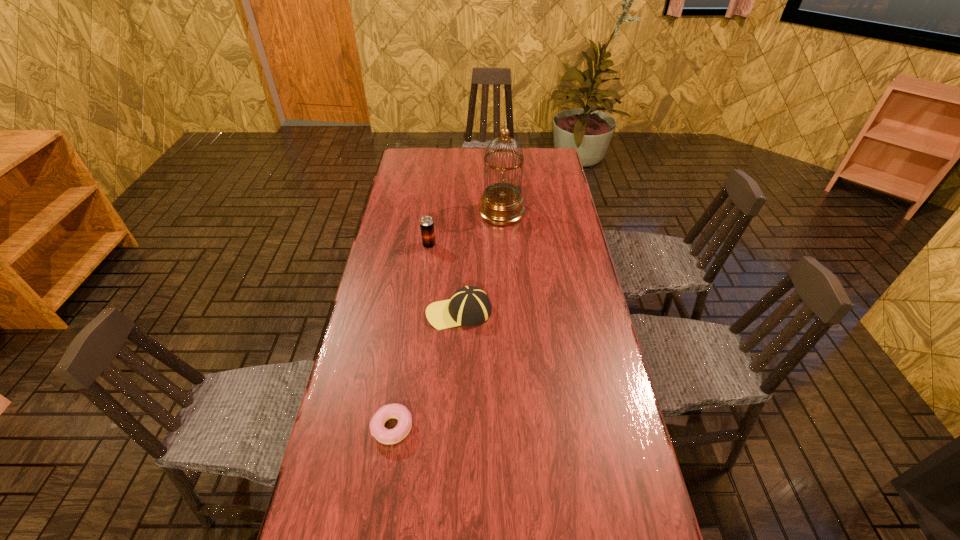
You are a GUI agent. You are given a task and a screenshot of the screen. Output one action in this format:
    pyautogui.click(x=<x>, y=<y>)
    Task: Click on the birdcage
    
    Given the screenshot: What is the action you would take?
    pyautogui.click(x=501, y=204)

This screenshot has height=540, width=960. What are the coordinates of `the farthest object` in the screenshot? It's located at (501, 204).

Find the location of `the third nearest object`. the third nearest object is located at coordinates (426, 223).

Where is `beer can`? Image resolution: width=960 pixels, height=540 pixels. beer can is located at coordinates (426, 223).

Identify the location of baseball cap. This screenshot has width=960, height=540. (469, 306).

Find the location of a particular element. Image resolution: width=960 pixels, height=540 pixels. the second shortest object is located at coordinates (469, 306).

Locate an element on the screen. Image resolution: width=960 pixels, height=540 pixels. the nearest object is located at coordinates (398, 411).

What are the coordinates of `the shortest object` in the screenshot? It's located at (398, 411).

The image size is (960, 540). In order to click on free location located 0.270m with an open door on the birdcage in this screenshot , I will do `click(411, 213)`.

You are a GUI agent. You are given a task and a screenshot of the screen. Output one action in this format:
    pyautogui.click(x=<x>, y=<y>)
    Task: Click on the vacant space located 0.200m with an open door on the birdcage
    The height and width of the screenshot is (540, 960).
    Given the screenshot: What is the action you would take?
    pyautogui.click(x=428, y=213)